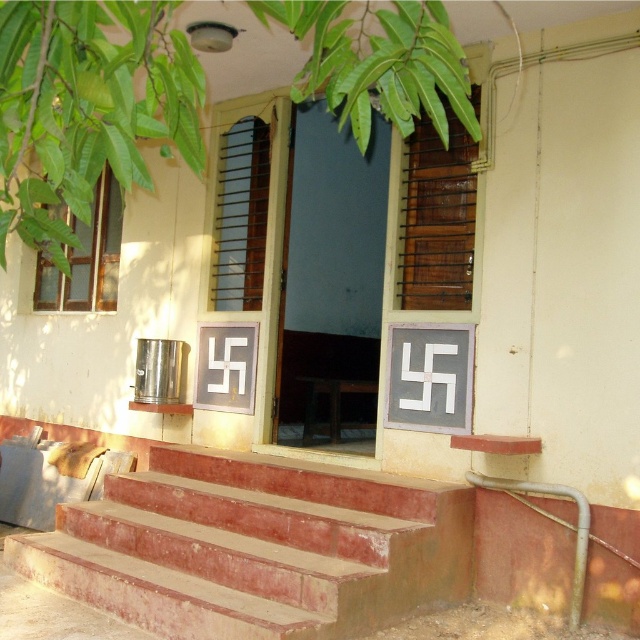
Does smooth concrete stairs at center come in front of brown wooden shutter at center?

Yes, smooth concrete stairs at center is in front of brown wooden shutter at center.

Between smooth concrete stairs at center and brown wooden shutter at center, which one is positioned higher?

brown wooden shutter at center is higher up.

Between point (278, 605) and point (248, 260), which one is positioned behind?

The point (248, 260) is behind.

In order to click on smooth concrete stairs at center in this screenshot , I will do `click(256, 548)`.

Is brown wooden shutter at upper center behind brown wooden shutter at center?

No, it is in front of brown wooden shutter at center.

Who is lower down, brown wooden shutter at upper center or brown wooden shutter at center?

brown wooden shutter at upper center is lower down.

Which is behind, point (416, 164) or point (260, 164)?

The point (260, 164) is behind.

Find the location of a particular element. Image resolution: width=640 pixels, height=640 pixels. brown wooden shutter at upper center is located at coordinates (436, 218).

Looking at this image, does smooth concrete stairs at center appear on the left side of brown wooden shutter at upper center?

Yes, smooth concrete stairs at center is to the left of brown wooden shutter at upper center.

Based on the photo, who is lower down, smooth concrete stairs at center or brown wooden shutter at upper center?

smooth concrete stairs at center

Measure the distance between smooth concrete stairs at center and camera.

smooth concrete stairs at center is 3.60 meters away from camera.

Find the location of `smooth concrete stairs at center`. smooth concrete stairs at center is located at coordinates tap(256, 548).